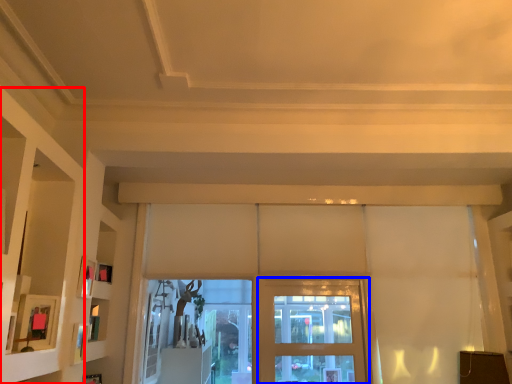
Question: Which object appears farthest to the camera in this image, shelf (highlighted by a red box) or screen door (highlighted by a blue box)?

Choices:
 (A) shelf
 (B) screen door

Answer: (B)